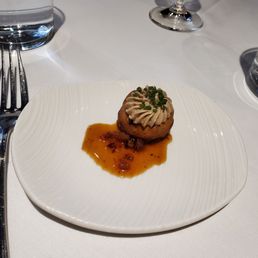
Where is `fork`? This screenshot has width=258, height=258. fork is located at coordinates (9, 116).